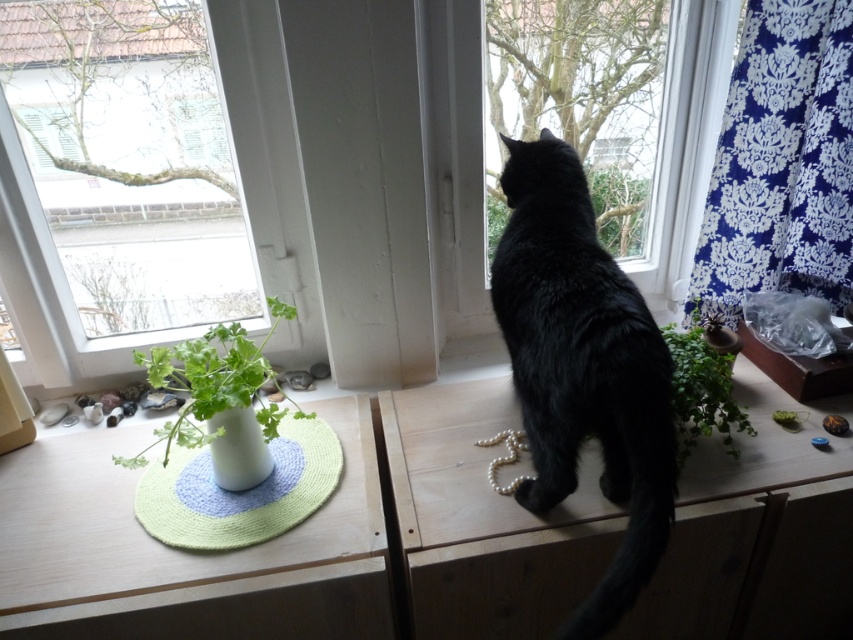
Can you confirm if blue damask fabric at upper right is positioned above green leafy plant at center?

Yes, blue damask fabric at upper right is above green leafy plant at center.

Does blue damask fabric at upper right come behind green leafy plant at center?

Yes, blue damask fabric at upper right is further from the viewer.

Which is in front, point (844, 115) or point (730, 401)?

Positioned in front is point (730, 401).

You are a GUI agent. You are given a task and a screenshot of the screen. Output one action in this format:
    pyautogui.click(x=<x>, y=<y>)
    Task: Click on the blue damask fabric at upper right
    This screenshot has height=640, width=853.
    Given the screenshot: What is the action you would take?
    pyautogui.click(x=782, y=161)

Is green knitted mat at lower left wider than white glossy vase at center?

Yes, green knitted mat at lower left is wider than white glossy vase at center.

The width and height of the screenshot is (853, 640). What are the coordinates of `green knitted mat at lower left` in the screenshot? It's located at (239, 492).

Which is in front, point (268, 536) or point (242, 408)?

Positioned in front is point (268, 536).

At what (x,y) coordinates should I click in order to perform the action: click on green knitted mat at lower left. Please return your answer as a coordinate pair (x, y). Looking at the image, I should click on (239, 492).

Can you confirm if black fur cat at center is positioned below green knitted mat at lower left?

No.

Which is above, black fur cat at center or green knitted mat at lower left?

black fur cat at center is higher up.

Is point (598, 257) closer to camera compared to point (189, 467)?

Yes, it is in front of point (189, 467).

Locate an element on the screen. black fur cat at center is located at coordinates (583, 368).